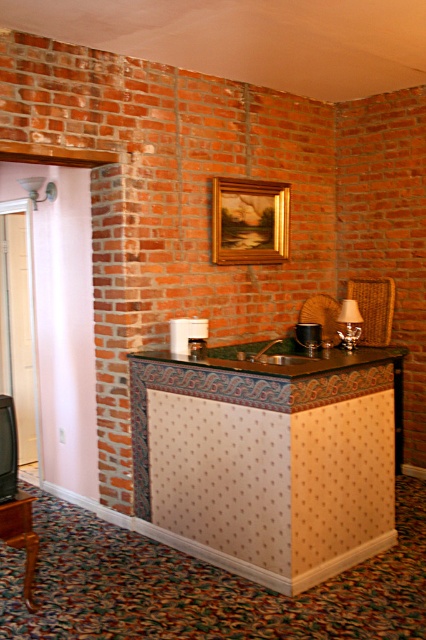
Looking at this image, you are sitting in the woven wicker armchair at center and want to look at the gold wooden picture frame at upper center. In which direction should you turn your head?

You should turn your head to the left to look at the gold wooden picture frame at upper center, as it is positioned to the left of the woven wicker armchair at center.

You are arranging a small table between the gold wooden picture frame at upper center and the woven wicker armchair at center. Which object should the table be placed closer to if you want it to be proportionally balanced based on their sizes?

The table should be placed closer to the woven wicker armchair at center because the gold wooden picture frame at upper center is larger, so balancing their sizes requires the table to compensate by being nearer to the smaller object.

You are sitting in the woven wicker armchair at center and want to look at the gold wooden picture frame at upper center. Can you see it without moving your head?

Yes, the gold wooden picture frame at upper center is in front of the woven wicker armchair at center, so you can see it without moving your head.